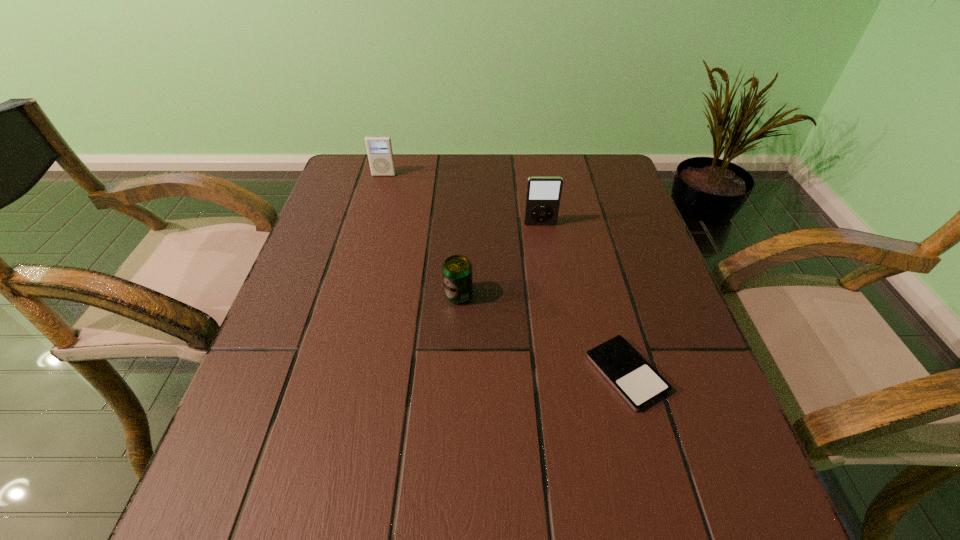
You are a GUI agent. You are given a task and a screenshot of the screen. Output one action in this format:
    pyautogui.click(x=<x>, y=<y>)
    Task: Click on the vacant position located on the right of the third object from right to left
    This screenshot has width=960, height=540.
    Given the screenshot: What is the action you would take?
    pyautogui.click(x=605, y=295)

Locate an element on the screen. vacant region located on the left of the shortest object is located at coordinates 468,373.

Locate an element on the screen. The image size is (960, 540). object that is at the far edge is located at coordinates (379, 148).

The width and height of the screenshot is (960, 540). What are the coordinates of `object at the left edge` in the screenshot? It's located at (379, 148).

Locate an element on the screen. object located in the right edge section of the desktop is located at coordinates (639, 384).

This screenshot has width=960, height=540. I want to click on object that is at the far left corner, so tap(379, 148).

You are a GUI agent. You are given a task and a screenshot of the screen. Output one action in this format:
    pyautogui.click(x=<x>, y=<y>)
    Task: Click on the free point at the far edge
    Image resolution: width=960 pixels, height=540 pixels.
    Given the screenshot: What is the action you would take?
    pyautogui.click(x=462, y=168)

Identify the location of free space at the left edge of the desktop. This screenshot has width=960, height=540. (283, 359).

Image resolution: width=960 pixels, height=540 pixels. Identify the location of free space at the right edge of the desktop. (651, 277).

Identify the location of vacant space at the far left corner. (330, 194).